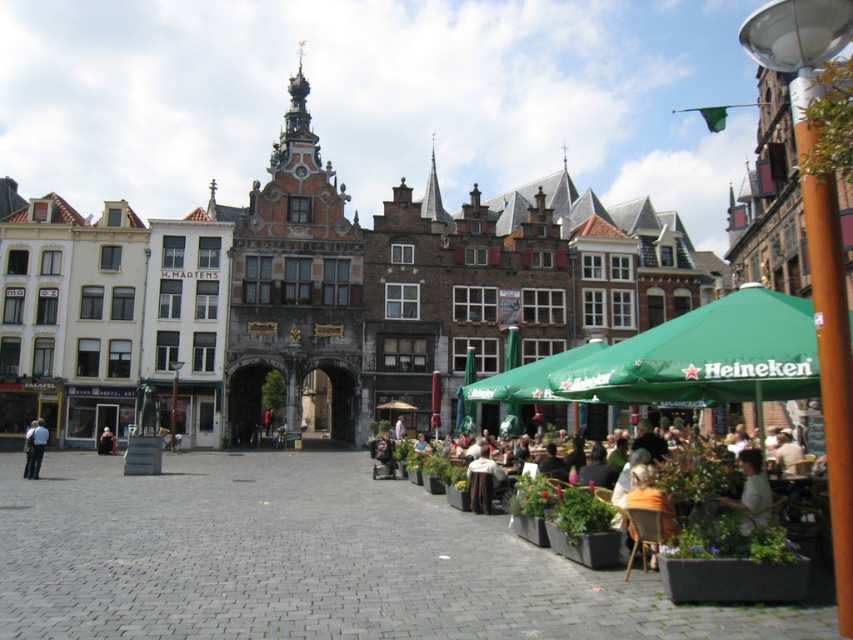
Question: Is light blue jeans at lower left to the left of dark blue jeans at center from the viewer's perspective?

Choices:
 (A) no
 (B) yes

Answer: (B)

Question: Does green fabric canopy at center lie behind light blue jeans at lower left?

Choices:
 (A) no
 (B) yes

Answer: (A)

Question: Does green fabric canopy at center appear on the left side of green fabric umbrella at lower right?

Choices:
 (A) yes
 (B) no

Answer: (A)

Question: Which is nearer to the light blue jeans at lower left?

Choices:
 (A) dark blue jeans at center
 (B) green fabric canopy at center

Answer: (A)

Question: Which object is closer to the camera taking this photo?

Choices:
 (A) dark blue jeans at center
 (B) green fabric canopy at center
 (C) light blue jeans at lower left

Answer: (B)

Question: Among these objects, which one is farthest from the camera?

Choices:
 (A) green fabric canopy at center
 (B) light blue jeans at lower left
 (C) green fabric umbrella at lower right

Answer: (B)